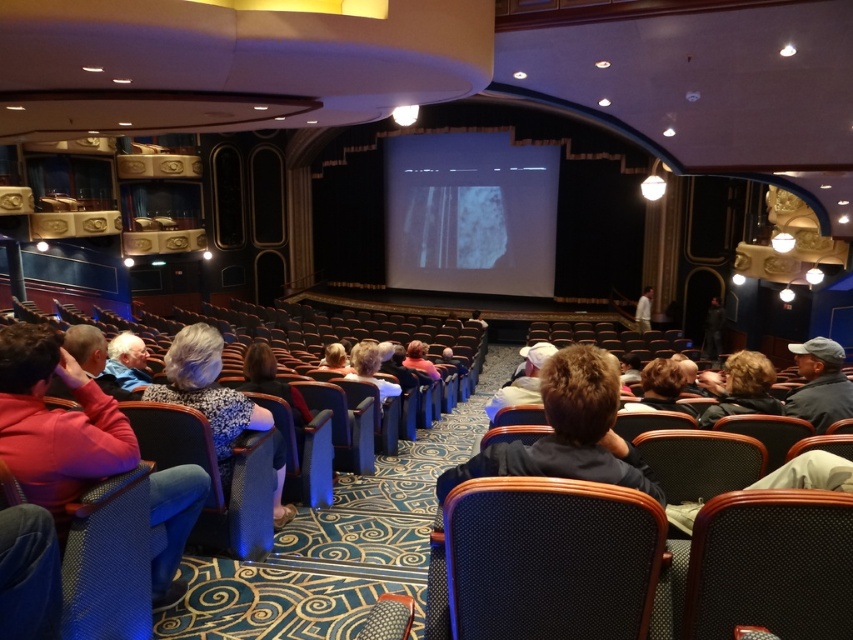
You are attending a theater event and need to choose seating between the textured black fabric chair at center and the black mesh chair at lower right. Which chair offers more seating space?

The textured black fabric chair at center is bigger than the black mesh chair at lower right, so it offers more seating space.